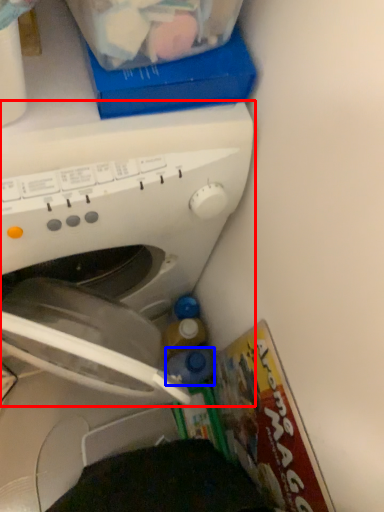
Question: Among these objects, which one is nearest to the camera, washing machine (highlighted by a red box) or bottle (highlighted by a blue box)?

Choices:
 (A) washing machine
 (B) bottle

Answer: (A)